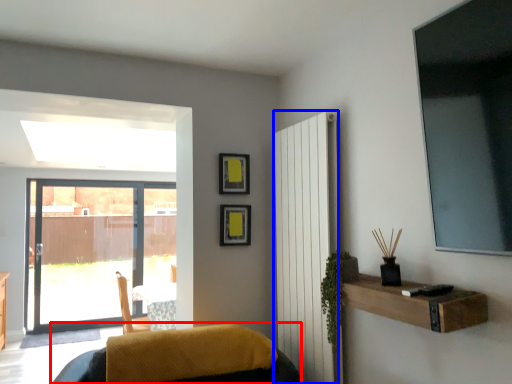
Question: Which point is closer to the camera, furniture (highlighted by a red box) or radiator (highlighted by a blue box)?

Choices:
 (A) furniture
 (B) radiator

Answer: (A)